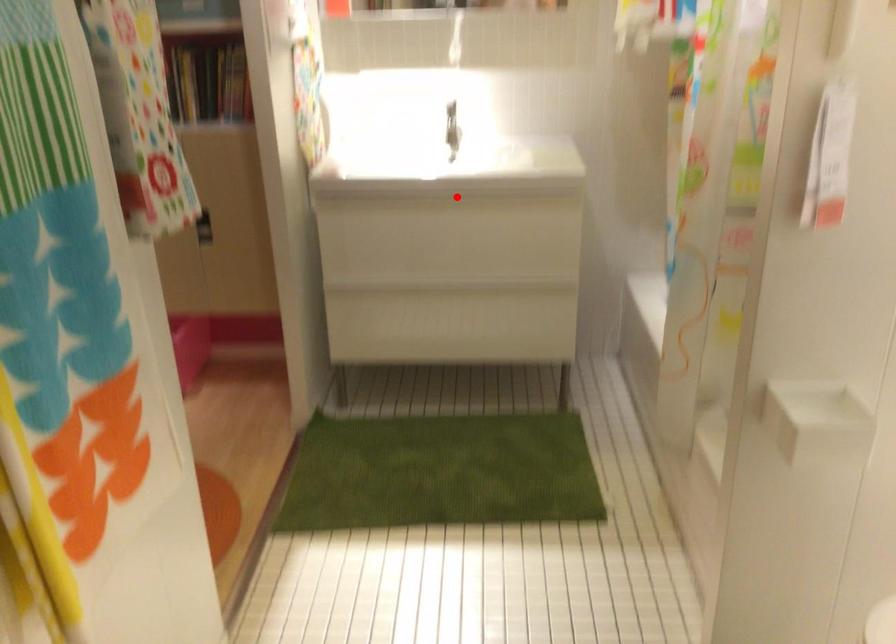
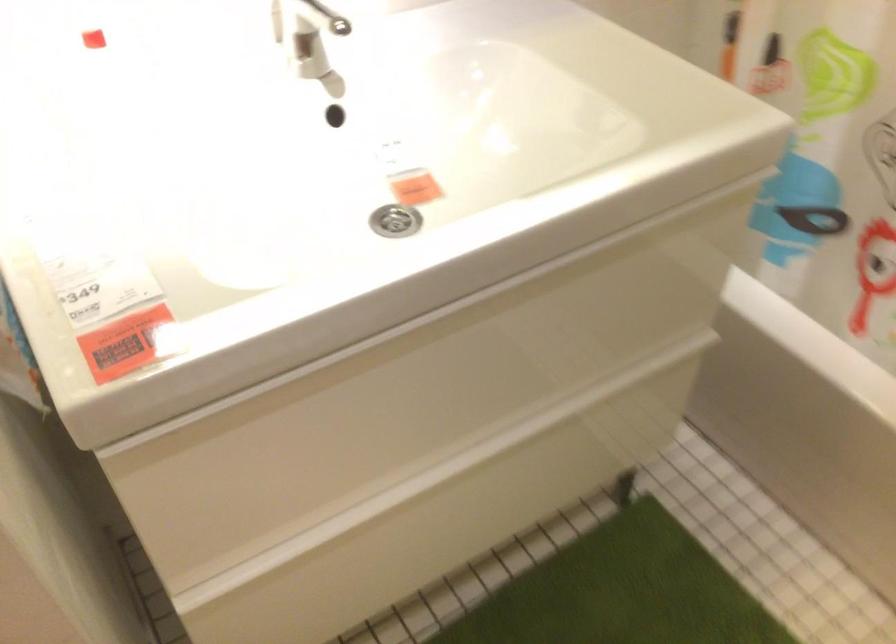
Where in the second image is the point corresponding to the highlighted location from the first image?

(394, 221)